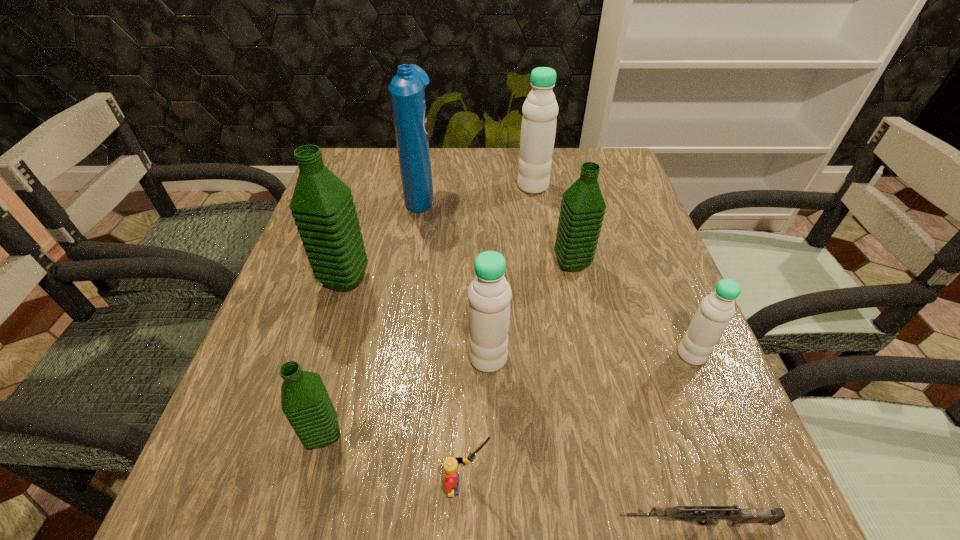
Find the location of `water bottle at the right edge`. water bottle at the right edge is located at coordinates (716, 310).

At what (x,y) coordinates should I click in order to perform the action: click on gun present at the right edge. Please return your answer as a coordinate pair (x, y). Image resolution: width=960 pixels, height=540 pixels. Looking at the image, I should click on pyautogui.click(x=701, y=515).

Identify the location of object that is at the near right corner. (701, 515).

Where is `vacant position at the far edge of the desktop`? This screenshot has height=540, width=960. vacant position at the far edge of the desktop is located at coordinates (503, 152).

In the image, there is a desktop. Identify the location of vacant region at the near edge. (402, 519).

Find the location of `blank space at the left edge of the desktop`. blank space at the left edge of the desktop is located at coordinates (345, 324).

Where is `vacant space at the right edge of the desktop`? vacant space at the right edge of the desktop is located at coordinates (651, 225).

Find the location of `vacant space at the far left corner of the desktop`. vacant space at the far left corner of the desktop is located at coordinates (389, 186).

The image size is (960, 540). Find the location of `free region at the far right corner of the desktop`. free region at the far right corner of the desktop is located at coordinates (616, 181).

Find the location of a particular element. This screenshot has height=540, width=960. vacant area that lies between the second biggest green water bottle and the farthest water bottle is located at coordinates (552, 225).